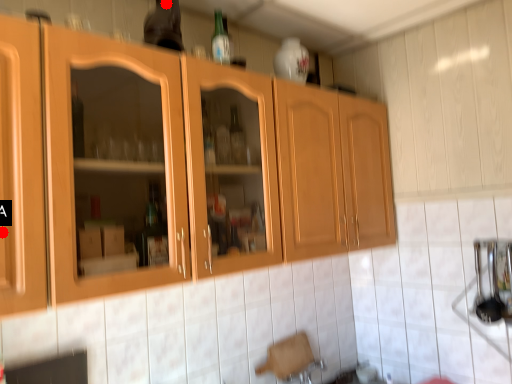
Question: Two points are circled on the image, labeled by A and B beside each circle. Which point is further to the camera?

Choices:
 (A) A is further
 (B) B is further

Answer: (B)